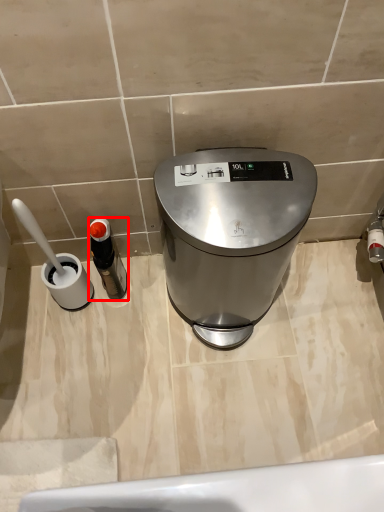
Question: From the image, what is the correct spatial relationship of bottle (annotated by the red box) in relation to waste container?

Choices:
 (A) left
 (B) right

Answer: (A)